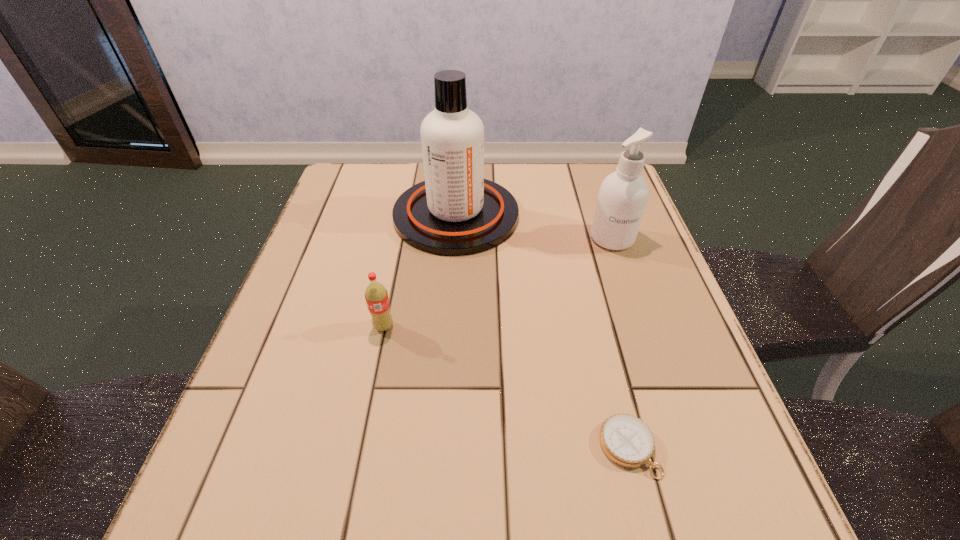
Locate an element on the screen. This screenshot has height=540, width=960. vacant area situated on the front of the third farthest object is located at coordinates (369, 398).

Where is `vacant space located on the left of the nearest object`? This screenshot has height=540, width=960. vacant space located on the left of the nearest object is located at coordinates (488, 448).

The image size is (960, 540). I want to click on object that is at the far edge, so click(x=455, y=212).

At what (x,y) coordinates should I click in order to perform the action: click on object at the near edge. Please return your answer as a coordinate pair (x, y). Image resolution: width=960 pixels, height=540 pixels. Looking at the image, I should click on (626, 440).

This screenshot has width=960, height=540. I want to click on cleansing agent situated at the right edge, so click(623, 195).

You are a GUI agent. You are given a task and a screenshot of the screen. Output one action in this format:
    pyautogui.click(x=<x>, y=<y>)
    Task: Click on the compass that is positioned at the right edge
    This screenshot has height=540, width=960.
    Given the screenshot: What is the action you would take?
    pyautogui.click(x=626, y=440)

This screenshot has height=540, width=960. I want to click on object located at the near right corner, so click(626, 440).

Where is `free space at the far edge`? free space at the far edge is located at coordinates (415, 178).

At what (x,y) coordinates should I click in order to perform the action: click on free space at the near edge of the desktop. Please return your answer as a coordinate pair (x, y). This screenshot has width=960, height=540. Looking at the image, I should click on (468, 517).

Where is `free location at the left edge`? This screenshot has height=540, width=960. free location at the left edge is located at coordinates (303, 349).